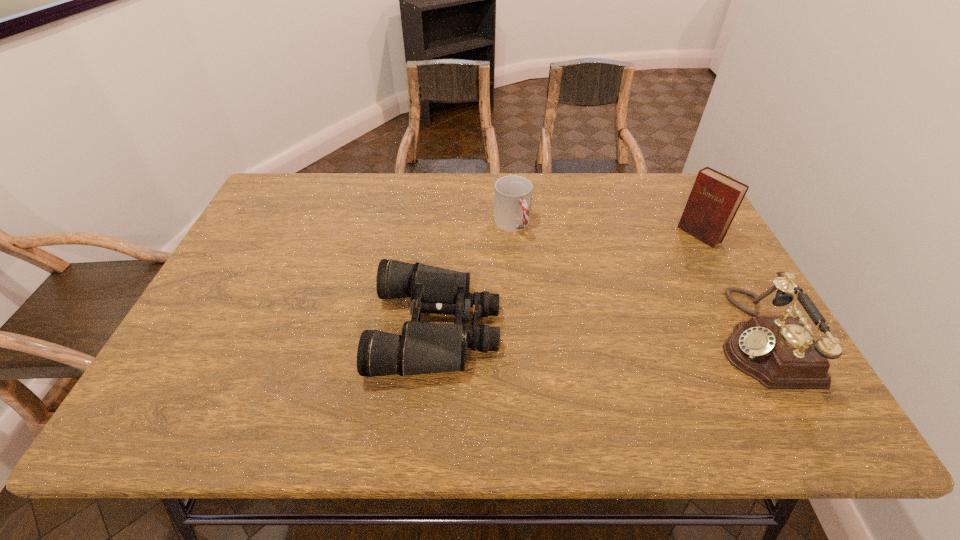
In order to click on free space on the desktop that is between the shortest object and the telephone and is positioned on the handle side of the cup in this screenshot , I will do `click(585, 332)`.

Find the location of a particular element. The width and height of the screenshot is (960, 540). vacant space on the desktop that is between the binoculars and the telephone and is positioned on the front cover of the diary is located at coordinates (550, 331).